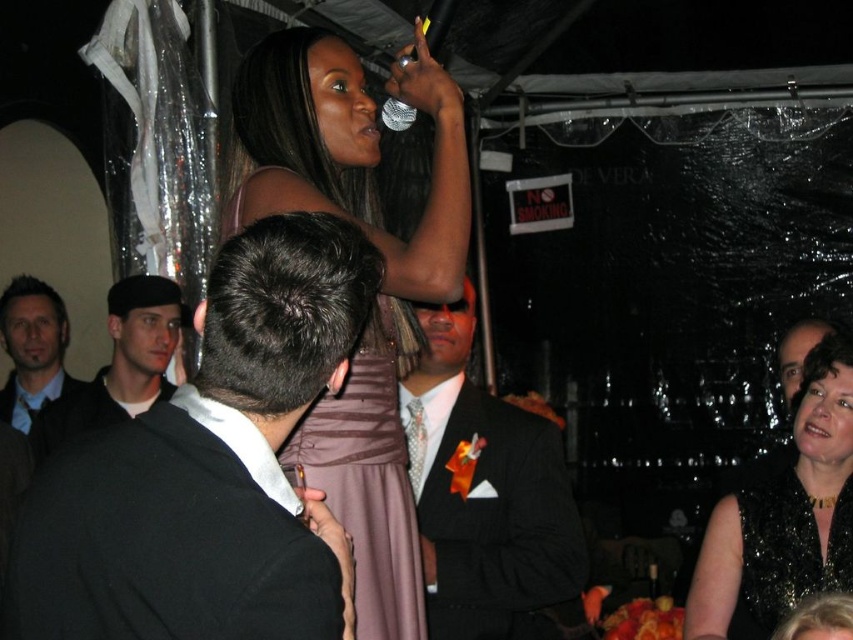
You are a photographer at the event and want to position your camera to capture the matte purple dress at upper center. According to the coordinates provided, what are the exact coordinates where you should aim your camera?

The exact coordinates to aim your camera are at point [381,288], where the matte purple dress at upper center is located.

You are a photographer at the event and want to capture a photo where both the matte purple dress at upper center and the black sequined dress at upper center are visible. Since the camera can only focus on one subject at a time, which dress should you focus on to ensure the other is still in the background?

The matte purple dress at upper center is much taller as black sequined dress at upper center, so focusing on the taller matte purple dress at upper center would keep the shorter black sequined dress at upper center in the background.

From the picture: You are organizing a charity event and need to decide which suit to choose for the host. The host is wearing the black satin suit at center and the shiny black suit at center. Based on their widths, which one is narrower?

The black satin suit at center is narrower than the shiny black suit at center because its width is less than the shiny black suit at center.